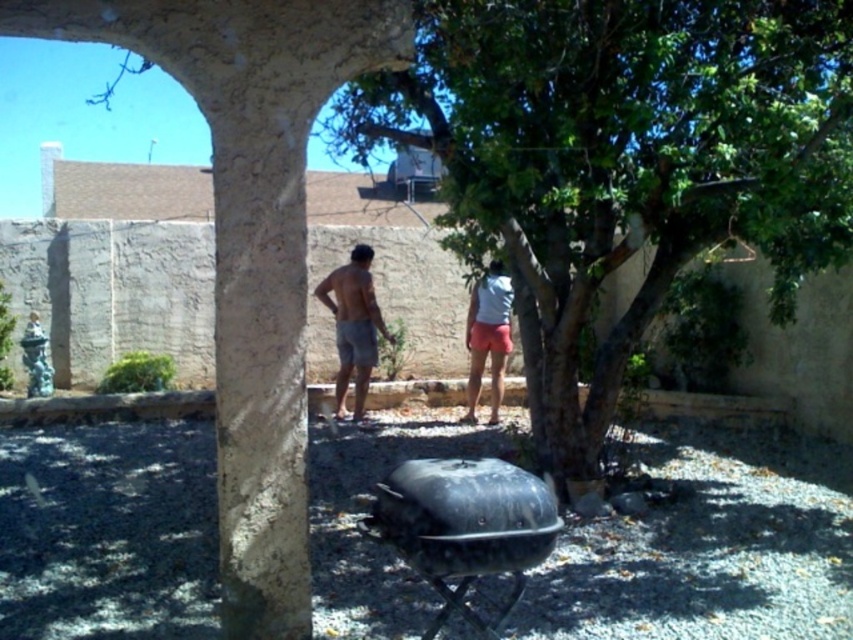
Question: Can you confirm if tan shorts at center is positioned above gray cotton shorts at center?

Choices:
 (A) yes
 (B) no

Answer: (A)

Question: Is tan shorts at center to the left of gray cotton shorts at center from the viewer's perspective?

Choices:
 (A) no
 (B) yes

Answer: (B)

Question: Which of the following is the farthest from the observer?

Choices:
 (A) light blue fabric shirt at center
 (B) gray cotton shorts at center
 (C) tan shorts at center
 (D) green leafy tree at center

Answer: (C)

Question: Among these objects, which one is nearest to the camera?

Choices:
 (A) green leafy tree at center
 (B) gray cotton shorts at center
 (C) tan shorts at center

Answer: (A)

Question: Does green leafy tree at center have a larger size compared to gray cotton shorts at center?

Choices:
 (A) yes
 (B) no

Answer: (A)

Question: Which of the following is the farthest from the observer?

Choices:
 (A) (491, 333)
 (B) (338, 296)

Answer: (B)